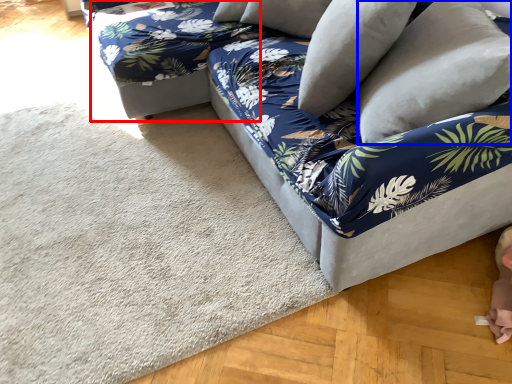
Question: Among these objects, which one is nearest to the camera, bean bag chair (highlighted by a red box) or pillow (highlighted by a blue box)?

Choices:
 (A) bean bag chair
 (B) pillow

Answer: (B)